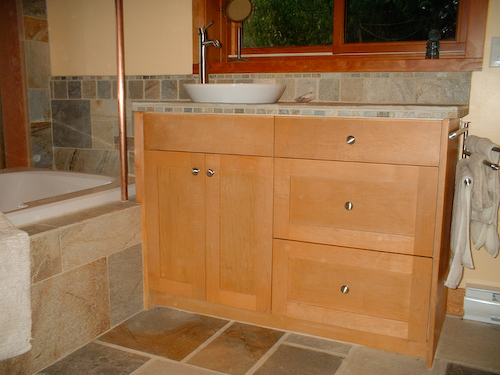
The image size is (500, 375). Identify the location of copper pipe. (126, 178).